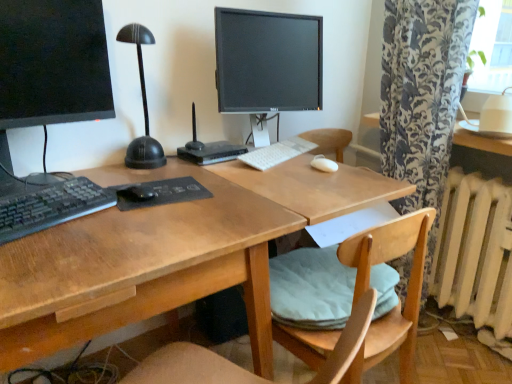
Where is `vacant space in front of white plastic keyboard at center`? Image resolution: width=512 pixels, height=384 pixels. vacant space in front of white plastic keyboard at center is located at coordinates (283, 175).